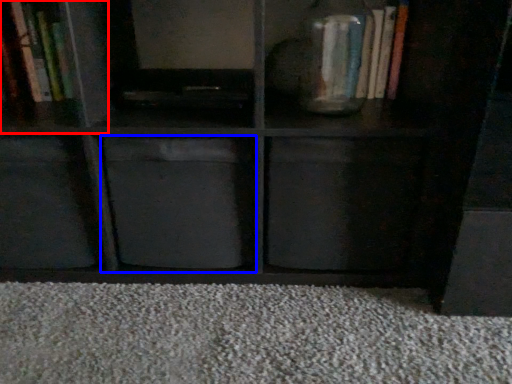
Question: Which of the following is the closest to the observer, cabinet (highlighted by a red box) or cabinet (highlighted by a blue box)?

Choices:
 (A) cabinet
 (B) cabinet

Answer: (B)